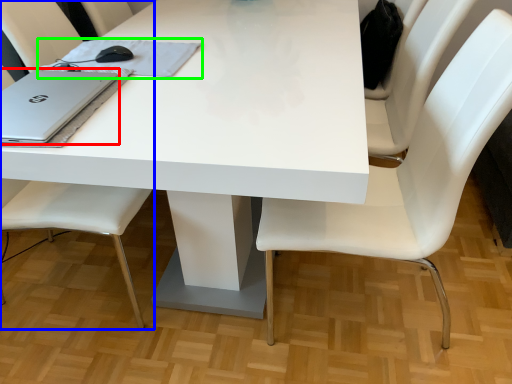
Question: Based on their relative distances, which object is nearer to laptop (highlighted by a red box)? Choose from chair (highlighted by a blue box) and notebook (highlighted by a green box).

Choices:
 (A) chair
 (B) notebook

Answer: (B)